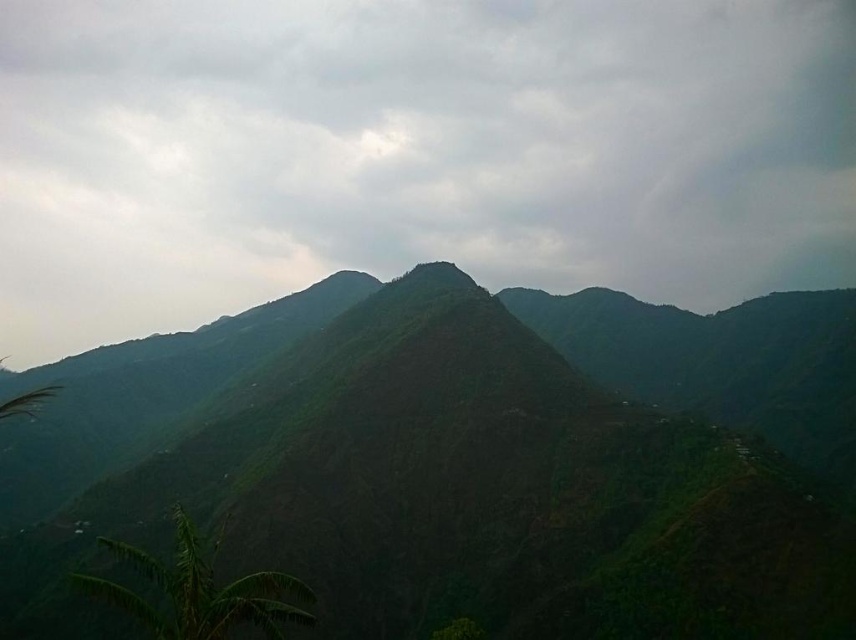
Which is more to the right, green matte cloud at upper center or green textured mountain at center?

Positioned to the right is green textured mountain at center.

Is green matte cloud at upper center wider than green textured mountain at center?

Indeed, green matte cloud at upper center has a greater width compared to green textured mountain at center.

Is point (266, 92) farther from viewer compared to point (776, 372)?

Yes.

The width and height of the screenshot is (856, 640). I want to click on green matte cloud at upper center, so click(x=413, y=152).

From the picture: Is green matte cloud at upper center closer to the viewer compared to green leafy plant at lower left?

That is False.

Which is behind, point (520, 51) or point (259, 600)?

The point (520, 51) is more distant.

Find the location of a particular element. green matte cloud at upper center is located at coordinates 413,152.

Does green textured mountain at center come behind green leafy plant at lower left?

Yes, it is behind green leafy plant at lower left.

Does green textured mountain at center come in front of green leafy plant at lower left?

No, green textured mountain at center is behind green leafy plant at lower left.

Locate an element on the screen. green textured mountain at center is located at coordinates (435, 476).